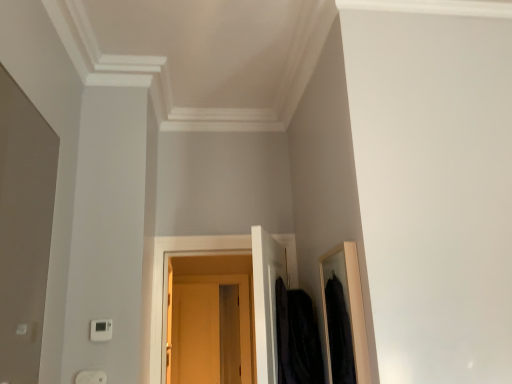
At what (x,y) coordinates should I click in order to perform the action: click on matte wood door at center. Please return your answer as a coordinate pair (x, y). Looking at the image, I should click on (240, 312).

Find the location of `white plastic electric outlet at lower left`. white plastic electric outlet at lower left is located at coordinates (91, 377).

Is velvet black coat at right bigger than white plastic thermostat at lower left?

Yes, velvet black coat at right is bigger than white plastic thermostat at lower left.

From the image's perspective, is velvet black coat at right on top of white plastic thermostat at lower left?

No, from the image's perspective, velvet black coat at right is not over white plastic thermostat at lower left.

What's the angular difference between velvet black coat at right and white plastic thermostat at lower left's facing directions?

There is a 66.7-degree angle between the facing directions of velvet black coat at right and white plastic thermostat at lower left.

Considering their positions, is velvet black coat at right located in front of or behind white plastic electric outlet at lower left?

velvet black coat at right is in front of white plastic electric outlet at lower left.

Which point is more distant from viewer, [314,337] or [82,376]?

Point [314,337]

Can you confirm if velvet black coat at right is wider than white plastic electric outlet at lower left?

Yes, velvet black coat at right is wider than white plastic electric outlet at lower left.

Is velvet black coat at right bigger than white plastic electric outlet at lower left?

Indeed, velvet black coat at right has a larger size compared to white plastic electric outlet at lower left.

In the scene shown: Are white plastic electric outlet at lower left and matte wood door at center located far from each other?

Yes, white plastic electric outlet at lower left and matte wood door at center are located far from each other.

From the image's perspective, is white plastic electric outlet at lower left beneath matte wood door at center?

No, from the image's perspective, white plastic electric outlet at lower left is not beneath matte wood door at center.

From the picture: Would you say matte wood door at center is part of white plastic electric outlet at lower left's contents?

No, matte wood door at center is not inside white plastic electric outlet at lower left.

Consider the image. Is white plastic electric outlet at lower left to the right of matte wood door at center from the viewer's perspective?

In fact, white plastic electric outlet at lower left is to the left of matte wood door at center.

Does white plastic thermostat at lower left appear on the right side of matte wood door at center?

No, white plastic thermostat at lower left is not to the right of matte wood door at center.

Locate an element on the screen. The width and height of the screenshot is (512, 384). door located below the white plastic thermostat at lower left (from the image's perspective) is located at coordinates (240, 312).

Which is behind, white plastic thermostat at lower left or matte wood door at center?

matte wood door at center is further away from the camera.

Is white plastic thermostat at lower left next to matte wood door at center?

white plastic thermostat at lower left and matte wood door at center are not in contact.

Which of these two, matte wood door at center or velvet black coat at right, stands taller?

Standing taller between the two is matte wood door at center.

From the image's perspective, which object appears higher, matte wood door at center or velvet black coat at right?

velvet black coat at right appears higher in the image.

Considering the sizes of objects matte wood door at center and velvet black coat at right in the image provided, who is bigger, matte wood door at center or velvet black coat at right?

Bigger between the two is matte wood door at center.

Which is in front, matte wood door at center or velvet black coat at right?

velvet black coat at right.

Considering the relative sizes of matte wood door at center and white plastic thermostat at lower left in the image provided, is matte wood door at center taller than white plastic thermostat at lower left?

Yes, matte wood door at center is taller than white plastic thermostat at lower left.

Is there a large distance between matte wood door at center and white plastic thermostat at lower left?

matte wood door at center is positioned a significant distance from white plastic thermostat at lower left.

Between point (243, 354) and point (90, 334), which one is positioned behind?

The point (243, 354) is farther from the camera.

Which is in front, matte wood door at center or white plastic thermostat at lower left?

white plastic thermostat at lower left is in front.

Is white plastic electric outlet at lower left positioned with its back to white plastic thermostat at lower left?

No, white plastic electric outlet at lower left is not facing the opposite direction of white plastic thermostat at lower left.

Considering the sizes of white plastic electric outlet at lower left and white plastic thermostat at lower left in the image, is white plastic electric outlet at lower left wider or thinner than white plastic thermostat at lower left?

white plastic electric outlet at lower left is wider than white plastic thermostat at lower left.

Can you confirm if white plastic electric outlet at lower left is smaller than white plastic thermostat at lower left?

No.

Considering the relative positions of white plastic electric outlet at lower left and white plastic thermostat at lower left in the image provided, is white plastic electric outlet at lower left behind white plastic thermostat at lower left?

No.

Where is `light switch lying on the left of velvet black coat at right`? light switch lying on the left of velvet black coat at right is located at coordinates (101, 330).

Locate an element on the screen. electric outlet behind the velvet black coat at right is located at coordinates (91, 377).

Looking at the image, which one is located closer to white plastic thermostat at lower left, white plastic electric outlet at lower left or matte wood door at center?

The object closer to white plastic thermostat at lower left is white plastic electric outlet at lower left.

From the image, which object appears to be farther from matte wood door at center, white plastic thermostat at lower left or velvet black coat at right?

white plastic thermostat at lower left.

Estimate the real-world distances between objects in this image. Which object is further from velvet black coat at right, white plastic thermostat at lower left or matte wood door at center?

matte wood door at center is further to velvet black coat at right.

Looking at the image, which one is located closer to white plastic electric outlet at lower left, white plastic thermostat at lower left or velvet black coat at right?

white plastic thermostat at lower left lies closer to white plastic electric outlet at lower left than the other object.

Considering their positions, is velvet black coat at right positioned closer to white plastic thermostat at lower left than white plastic electric outlet at lower left?

white plastic electric outlet at lower left lies closer to white plastic thermostat at lower left than the other object.

Estimate the real-world distances between objects in this image. Which object is further from matte wood door at center, white plastic thermostat at lower left or white plastic electric outlet at lower left?

white plastic electric outlet at lower left.

Based on their spatial positions, is white plastic electric outlet at lower left or velvet black coat at right closer to white plastic thermostat at lower left?

white plastic electric outlet at lower left.

Considering their positions, is white plastic electric outlet at lower left positioned closer to velvet black coat at right than matte wood door at center?

Among the two, white plastic electric outlet at lower left is located nearer to velvet black coat at right.

I want to click on light switch positioned between white plastic electric outlet at lower left and matte wood door at center from near to far, so click(x=101, y=330).

Locate an element on the screen. electric outlet located between velvet black coat at right and matte wood door at center in the depth direction is located at coordinates (91, 377).

Find the location of a particular element. The image size is (512, 384). light switch situated between white plastic electric outlet at lower left and velvet black coat at right from left to right is located at coordinates (101, 330).

The width and height of the screenshot is (512, 384). I want to click on light switch located between velvet black coat at right and matte wood door at center in the depth direction, so click(x=101, y=330).